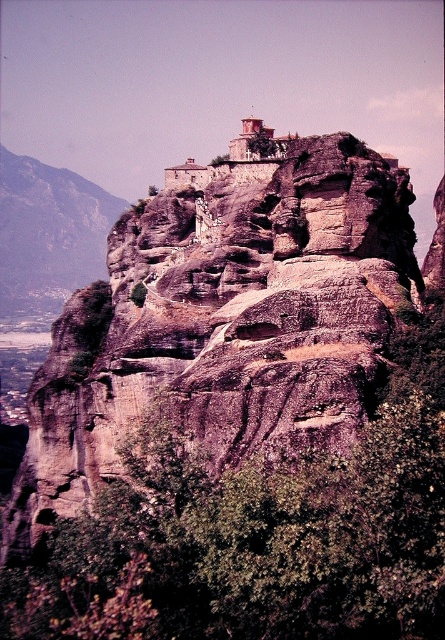
Is rustic stone cliff at upper center below rugged stone mountain at left?

Yes.

Is rustic stone cliff at upper center wider than rugged stone mountain at left?

Correct, the width of rustic stone cliff at upper center exceeds that of rugged stone mountain at left.

This screenshot has height=640, width=445. Describe the element at coordinates (226, 323) in the screenshot. I see `rustic stone cliff at upper center` at that location.

Find the location of a particular element. rustic stone cliff at upper center is located at coordinates (226, 323).